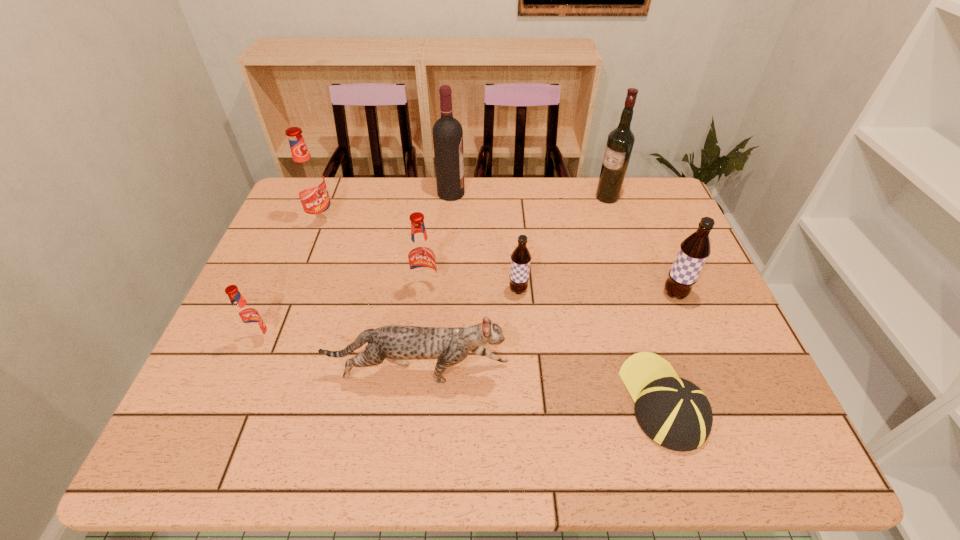
Select which root beer is the second closest to the cat. Please provide its 2D coordinates. Your answer should be formatted as a tuple, i.e. [(x, y)], where the tuple contains the x and y coordinates of a point satisfying the conditions above.

[(422, 262)]

Identify which red root beer is the closest to the left wine bottle. Please provide its 2D coordinates. Your answer should be formatted as a tuple, i.e. [(x, y)], where the tuple contains the x and y coordinates of a point satisfying the conditions above.

[(308, 179)]

Locate which red root beer is the closest to the right wine bottle. Please provide its 2D coordinates. Your answer should be formatted as a tuple, i.e. [(x, y)], where the tuple contains the x and y coordinates of a point satisfying the conditions above.

[(422, 262)]

Locate an element on the screen. The image size is (960, 540). blank space that satisfies the following two spatial constraints: 1. on the face of the cat; 2. with the brim of the baseball cap facing forward is located at coordinates (415, 401).

Find the location of a particular element. This screenshot has width=960, height=540. free space that satisfies the following two spatial constraints: 1. on the label of the left wine bottle; 2. on the back side of the rightmost root beer is located at coordinates (444, 294).

Find the location of a particular element. vacant space that satisfies the following two spatial constraints: 1. with the brim of the shortest object facing forward; 2. on the face of the cat is located at coordinates (654, 373).

I want to click on vacant space that satisfies the following two spatial constraints: 1. on the back side of the smallest red root beer; 2. on the left side of the third root beer from right to left, so click(282, 289).

The height and width of the screenshot is (540, 960). What are the coordinates of `free space that satisfies the following two spatial constraints: 1. on the front and back of the right wine bottle; 2. on the front side of the biggest red root beer` in the screenshot? It's located at (615, 221).

Find the location of `vacant area in the image that satisfies the following two spatial constraints: 1. on the back side of the nearest root beer; 2. on the left side of the smaller brown root beer`. vacant area in the image that satisfies the following two spatial constraints: 1. on the back side of the nearest root beer; 2. on the left side of the smaller brown root beer is located at coordinates (282, 291).

I want to click on free region that satisfies the following two spatial constraints: 1. with the brim of the baseball cap facing forward; 2. on the left side of the bigger brown root beer, so click(x=629, y=294).